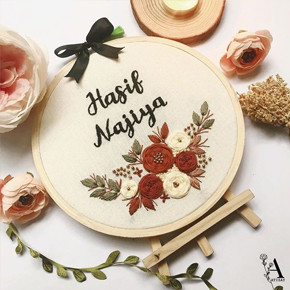
Identify the location of wooden frame. This screenshot has height=290, width=290. (178, 224).